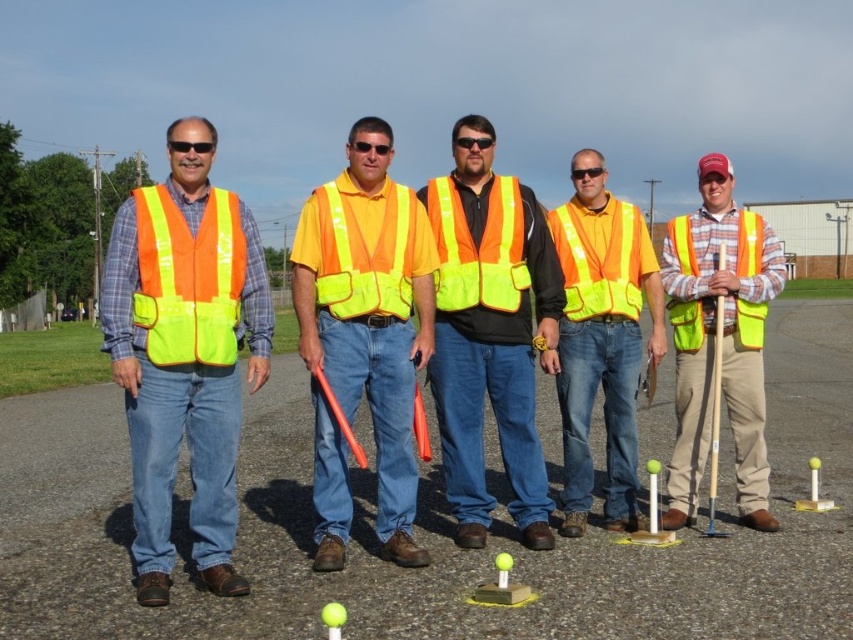
Question: Is yellow rubber tee at center positioned behind matte orange safety vest at center?

Choices:
 (A) no
 (B) yes

Answer: (A)

Question: Can you confirm if high visibility fabric safety vest at left is smaller than high-visibility fabric safety vest at center?

Choices:
 (A) no
 (B) yes

Answer: (B)

Question: Which of the following is the farthest from the observer?

Choices:
 (A) high visibility fabric safety vest at left
 (B) high visibility vest at center

Answer: (B)

Question: Which of the following is the farthest from the observer?

Choices:
 (A) (161, 198)
 (B) (587, 180)
 (C) (222, 346)

Answer: (B)

Question: Does yellow rubber tee at center have a lesser width compared to matte orange safety vest at center?

Choices:
 (A) no
 (B) yes

Answer: (A)

Question: Which object is positioned farthest from the hi-visibility reflective vest at left?

Choices:
 (A) high visibility reflective safety vest at center
 (B) high-visibility fabric safety vest at center
 (C) high visibility fabric safety vest at left

Answer: (A)